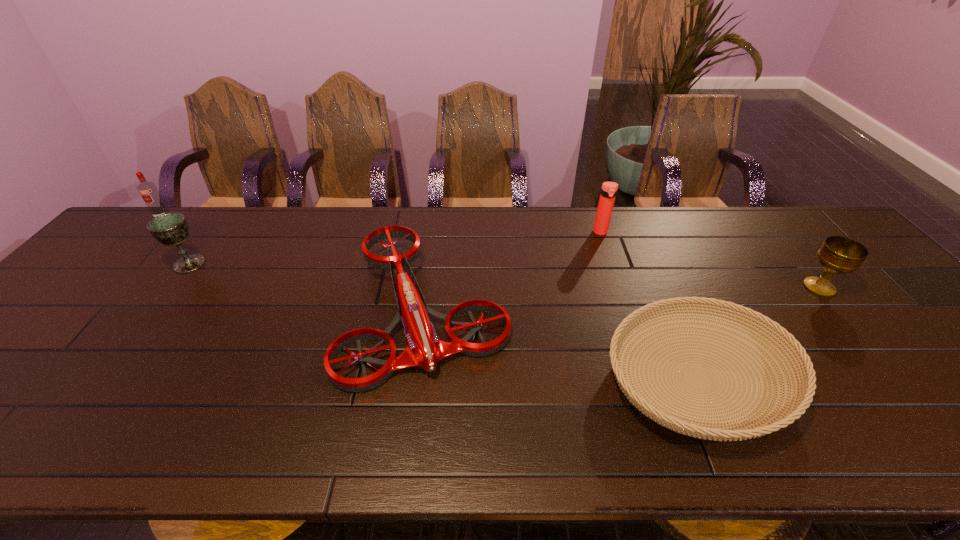
This screenshot has width=960, height=540. I want to click on free region located 0.190m on the right of the fifth nearest object, so click(668, 233).

Identify the location of vacant area located on the front label of the farthest object. The height and width of the screenshot is (540, 960). (132, 250).

You are a GUI agent. You are given a task and a screenshot of the screen. Output one action in this format:
    pyautogui.click(x=<x>, y=<y>)
    Task: Click on the free space located on the front of the left chalice
    
    Given the screenshot: What is the action you would take?
    pyautogui.click(x=105, y=375)

Identify the location of blank space located 0.260m on the left of the rightmost object. (706, 287).

At what (x,y) coordinates should I click in order to perform the action: click on vacant region located 0.330m on the right of the third object from left to right. Please return your answer as a coordinate pair (x, y). Image resolution: width=960 pixels, height=540 pixels. Looking at the image, I should click on (637, 309).

Where is `free space located 0.280m on the back of the basket`? free space located 0.280m on the back of the basket is located at coordinates (641, 250).

I want to click on thermos bottle located at the far edge, so click(609, 189).

The width and height of the screenshot is (960, 540). I want to click on vodka present at the far edge, so click(148, 190).

At what (x,y) coordinates should I click in order to perform the action: click on drone located at the far edge. Please return your answer as a coordinate pair (x, y). Looking at the image, I should click on (424, 349).

You are a GUI agent. You are given a task and a screenshot of the screen. Output one action in this format:
    pyautogui.click(x=<x>, y=<y>)
    Task: Click on the object located in the near edge section of the desktop
    The width and height of the screenshot is (960, 540).
    Given the screenshot: What is the action you would take?
    pyautogui.click(x=796, y=405)